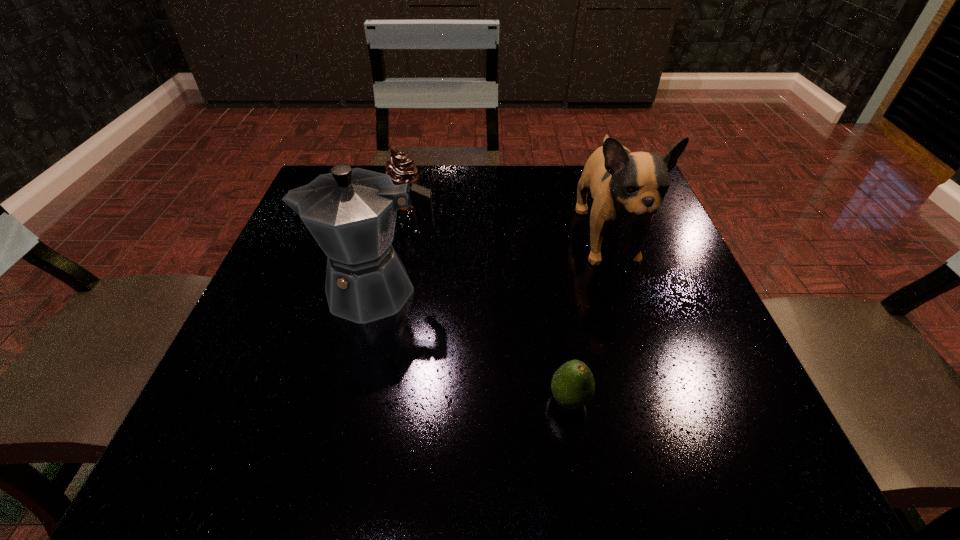
Locate an element on the screen. This screenshot has height=540, width=960. vacant area located 0.080m on the left of the nearest object is located at coordinates (497, 400).

The height and width of the screenshot is (540, 960). What are the coordinates of `puppy present at the far edge` in the screenshot? It's located at tap(627, 188).

Find the location of a particular element. The height and width of the screenshot is (540, 960). icecream located at the far edge is located at coordinates (401, 169).

Identify the location of object at the near edge. The height and width of the screenshot is (540, 960). pyautogui.click(x=573, y=386).

Locate an element on the screen. object located at the left edge is located at coordinates (351, 213).

What are the coordinates of `object that is at the right edge` in the screenshot? It's located at (627, 188).

Find the location of a particular element. object positioned at the far right corner is located at coordinates (627, 188).

In the image, there is a desktop. In order to click on vacant region at the far edge in this screenshot , I will do `click(554, 206)`.

You are a GUI agent. You are given a task and a screenshot of the screen. Output one action in this format:
    pyautogui.click(x=<x>, y=<y>)
    Task: Click on the vacant space at the near edge of the desktop
    
    Given the screenshot: What is the action you would take?
    pyautogui.click(x=330, y=424)

At what (x,y) coordinates should I click in order to perform the action: click on free space at the right edge of the desktop. Please return your answer as a coordinate pair (x, y). This screenshot has width=960, height=540. Looking at the image, I should click on (646, 349).